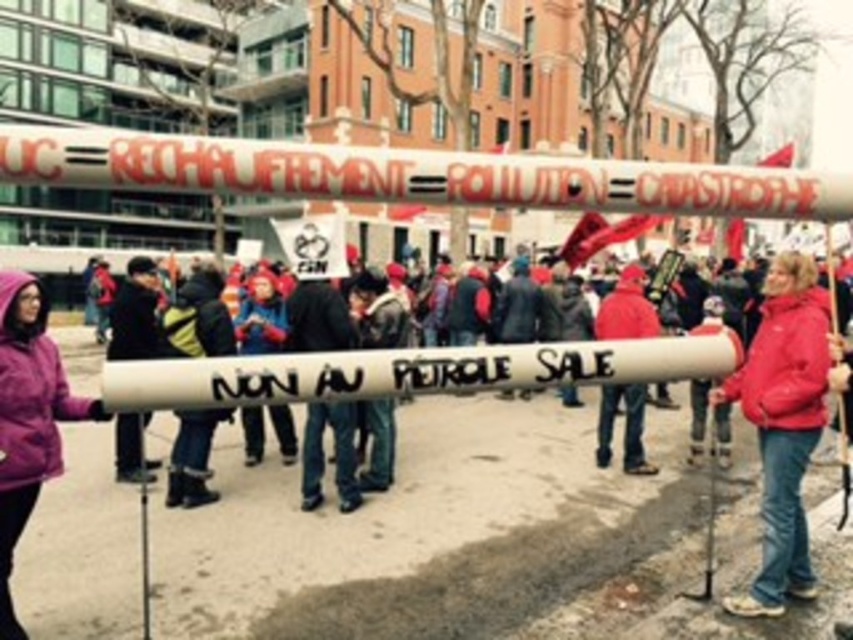
You are a photographer at the protest scene. You want to take a photo that includes both the purple fleece jacket at left and the red woolen hat at center. Which object should you focus on first to ensure both are in frame?

The purple fleece jacket at left is larger in size than the red woolen hat at center. To ensure both are in frame, focus on the larger purple fleece jacket at left first, then adjust the camera angle to include the smaller red woolen hat at center.

You are a photographer trying to capture a clear photo of the protest. You notice the purple fleece jacket at left and the red woolen hat at center. Which object should you focus on to ensure it occupies more space in your photo?

The purple fleece jacket at left might be wider than the red woolen hat at center, so focusing on the purple fleece jacket at left would likely occupy more space in the photo.